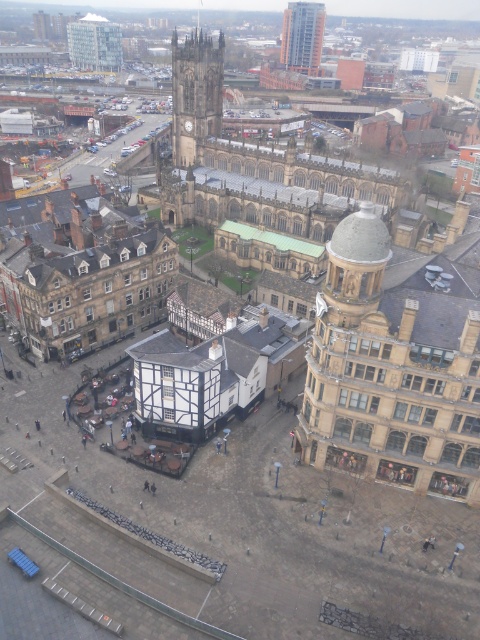
You are a drone operator flying over the city and need to deliver a package to both the point at coordinates point (316, 388) and point (316, 13). Which point should you reach first if you want to minimize altitude adjustments?

You should reach point (316, 388) first because it is closer to the viewer than point (316, 13), so you can deliver the package at a lower altitude before ascending to reach the farther point.

You are a city planner analyzing the urban layout. Given the beige stone tower at center right and the glassy steel skyscraper at upper center, which structure occupies a greater area in the cityscape?

The beige stone tower at center right has a larger size compared to the glassy steel skyscraper at upper center, so it occupies a greater area in the cityscape.

From the picture: You are a city planner analyzing the skyline of this area. Based on the image, which of the two structures, the dark gray stone clock tower at center or the glassy steel skyscraper at upper center, would cast a longer shadow during midday? Please explain your reasoning using their relative positions and heights.

The glassy steel skyscraper at upper center is taller than the dark gray stone clock tower at center. Since taller structures cast longer shadows, the glassy steel skyscraper at upper center would cast a longer shadow during midday.